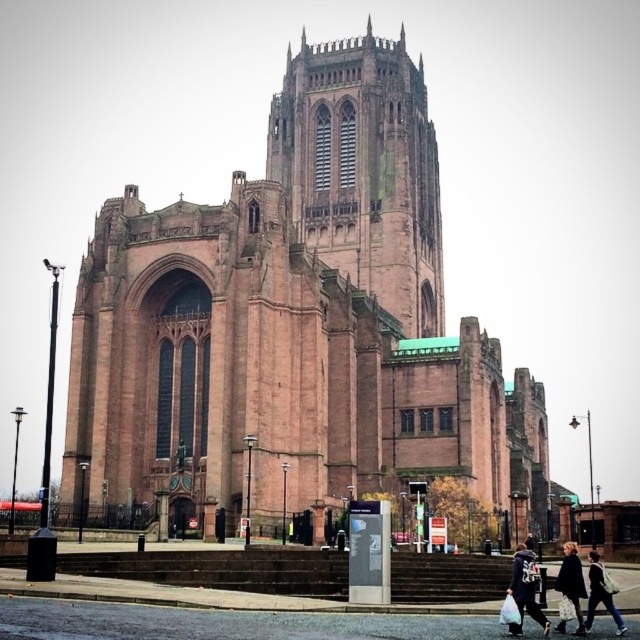
Question: Among these objects, which one is farthest from the camera?

Choices:
 (A) denim jacket at lower right
 (B) brown stone tower at center

Answer: (B)

Question: Is denim jacket at lower right above dark blue denim jacket at lower right?

Choices:
 (A) yes
 (B) no

Answer: (A)

Question: Which point is farther to the camera?

Choices:
 (A) denim jacket at lower right
 (B) reddish-brown stone church at center

Answer: (B)

Question: Can you confirm if brown stone tower at center is positioned below dark brown leather jacket at lower right?

Choices:
 (A) yes
 (B) no

Answer: (B)

Question: In this image, where is dark blue denim jacket at lower right located relative to fluffy black coat at lower right?

Choices:
 (A) left
 (B) right

Answer: (A)

Question: Which point appears farthest from the camera in this image?

Choices:
 (A) (577, 596)
 (B) (529, 609)
 (C) (321, 58)

Answer: (C)